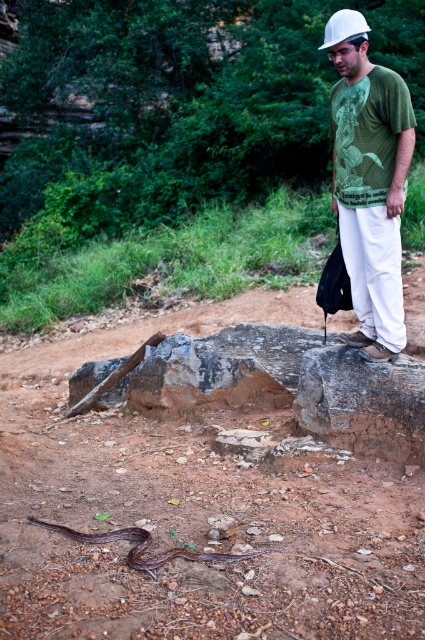
Question: Considering the relative positions of green matte t-shirt at center and white hard hat at upper center in the image provided, where is green matte t-shirt at center located with respect to white hard hat at upper center?

Choices:
 (A) below
 (B) above

Answer: (A)

Question: Can you confirm if brown dirt track at lower center is smaller than green matte t-shirt at center?

Choices:
 (A) no
 (B) yes

Answer: (B)

Question: Which point is farther to the camera?

Choices:
 (A) brown dirt track at lower center
 (B) white hard hat at upper center

Answer: (B)

Question: Does brown dirt track at lower center have a greater width compared to white hard hat at upper center?

Choices:
 (A) no
 (B) yes

Answer: (B)

Question: Among these points, which one is nearest to the camera?

Choices:
 (A) (19, 426)
 (B) (333, 26)
 (C) (354, 38)

Answer: (C)

Question: Which object is positioned farthest from the white hard hat at upper center?

Choices:
 (A) green matte t-shirt at center
 (B) brown dirt track at lower center

Answer: (B)